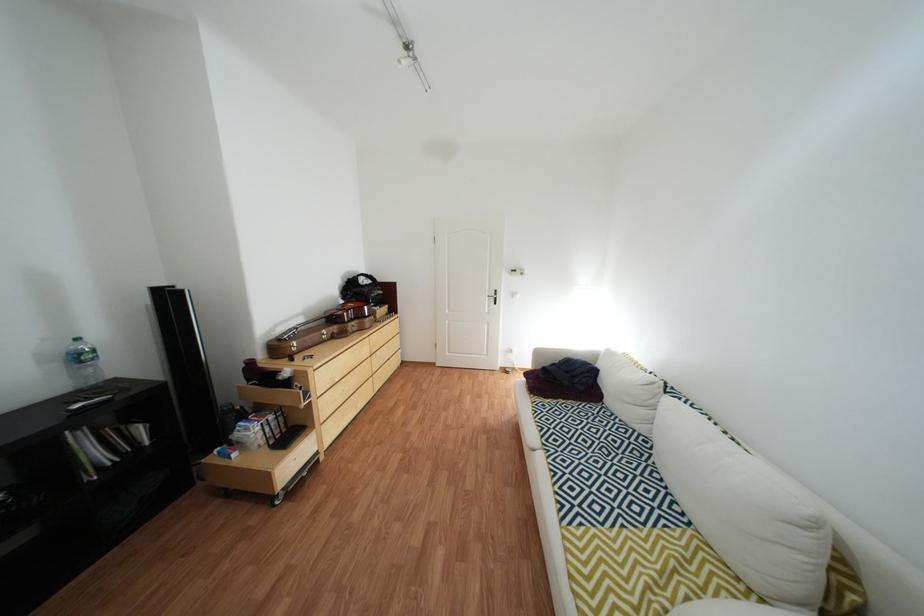
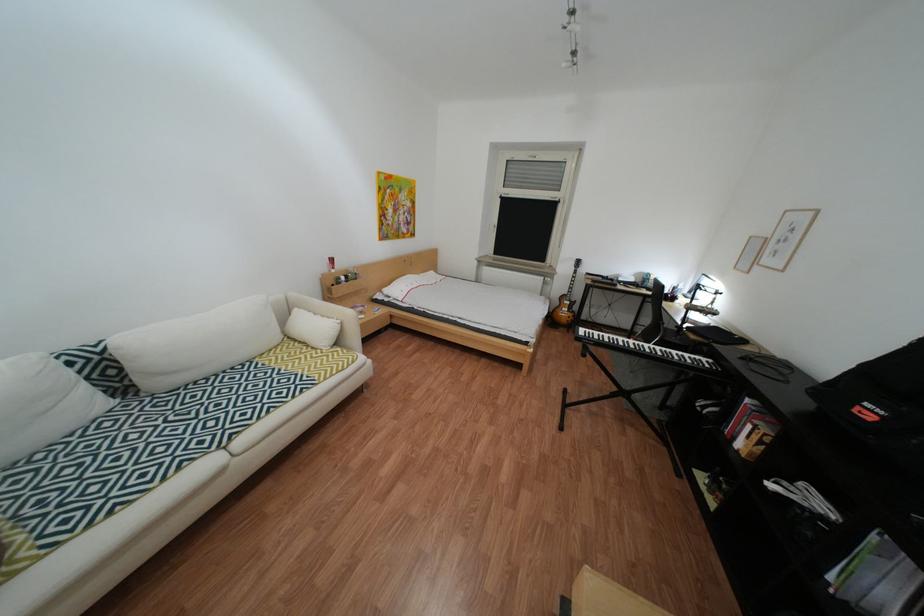
The point at (581, 431) is marked in the first image. Where is the corresponding point in the second image?

(176, 450)